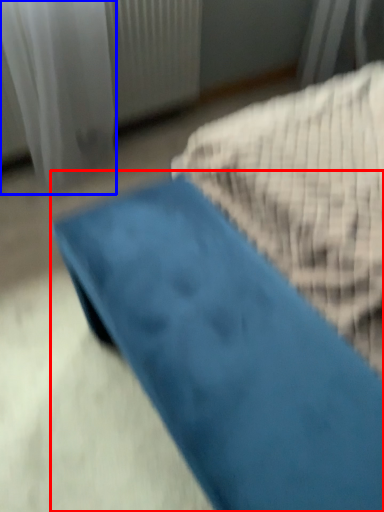
Question: Which of the following is the closest to the observer, furniture (highlighted by a red box) or curtain (highlighted by a blue box)?

Choices:
 (A) furniture
 (B) curtain

Answer: (A)